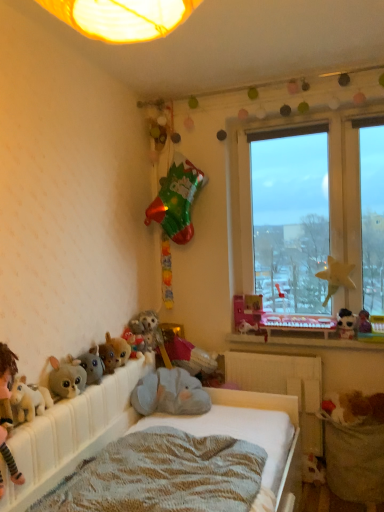
The height and width of the screenshot is (512, 384). Identify the location of free point to the left of white plush toy at right, the first miniature ordered from the bottom. (325, 337).